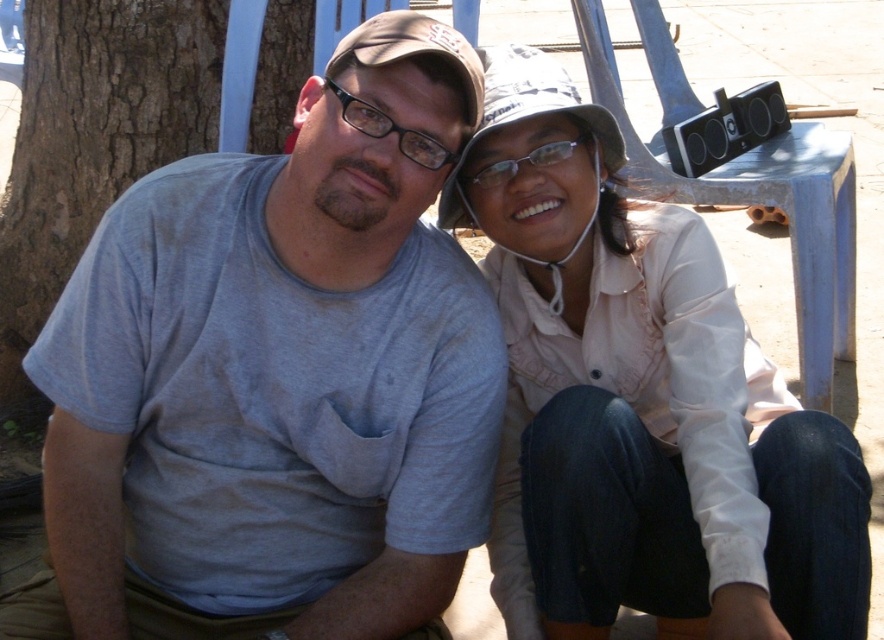
You are a photographer taking a picture of the two people sitting together. You want to focus on the brown fabric baseball hat at center but also include the brown rough bark at left in the frame. Which object should you adjust your camera focus on first to ensure both are in focus?

The brown rough bark at left is further to the viewer than the brown fabric baseball hat at center, so you should focus on the brown rough bark at left first to ensure both are in focus.

You are a photographer trying to capture a candid shot of the two people sitting together. You notice the brown rough bark at left and the brown fabric baseball hat at center in your viewfinder. Which object should you adjust your focus to avoid blurring, considering their height difference?

The brown rough bark at left is taller than the brown fabric baseball hat at center, so you should focus on the brown rough bark at left to ensure it doesn